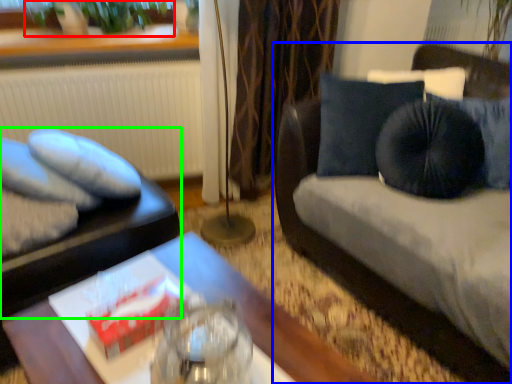
Question: Which object is the farthest from plant (highlighted by a red box)? Choose among these: studio couch (highlighted by a blue box) or furniture (highlighted by a green box).

Choices:
 (A) studio couch
 (B) furniture

Answer: (A)